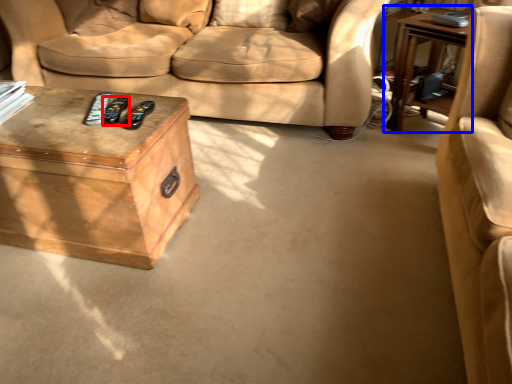
Question: Which of the following is the closest to the observer, remote (highlighted by a red box) or table (highlighted by a blue box)?

Choices:
 (A) remote
 (B) table

Answer: (A)